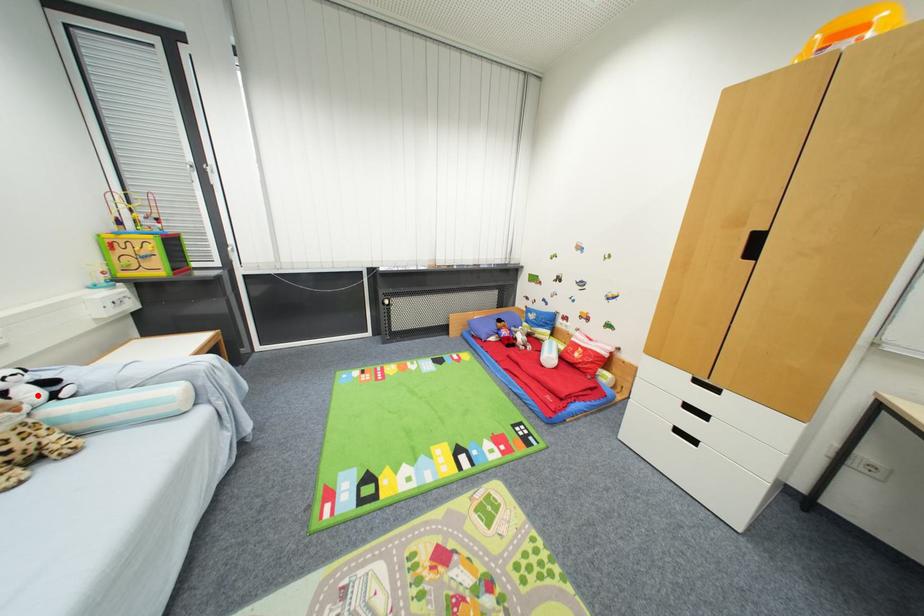
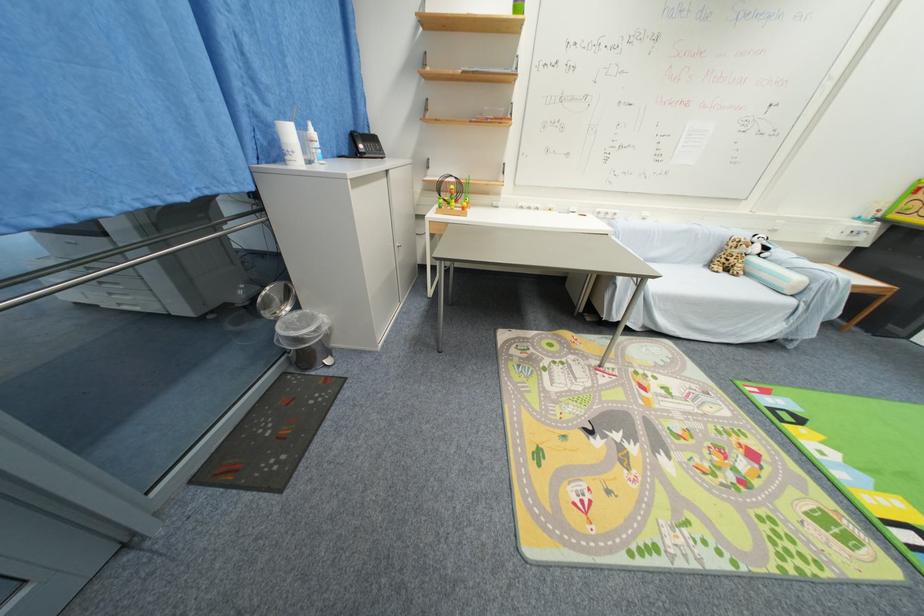
Question: I am providing you with two images of the same scene from different viewpoints. In image1, a red point is highlighted. Considering the same 3D point in image2, which of the following is correct?

Choices:
 (A) It is closer
 (B) It is farther

Answer: (A)